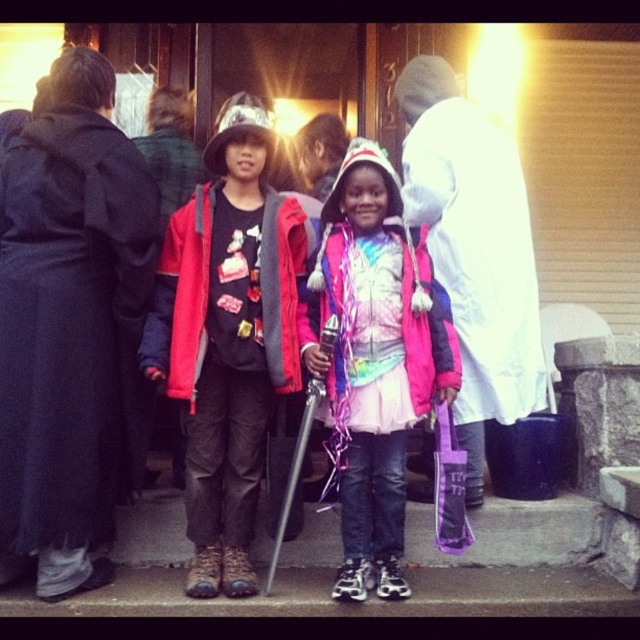
Question: Which object is closer to the camera taking this photo?

Choices:
 (A) matte red jacket at center
 (B) pink matte jacket at center
 (C) pink fabric umbrella at center
 (D) black matte robe at left

Answer: (D)

Question: Is the position of black matte robe at left more distant than that of pink fabric umbrella at center?

Choices:
 (A) no
 (B) yes

Answer: (A)

Question: Which point is farther from the camera taking this photo?

Choices:
 (A) (397, 97)
 (B) (342, 180)

Answer: (A)

Question: Which object is positioned farthest from the pink matte jacket at center?

Choices:
 (A) black matte robe at left
 (B) pink fabric umbrella at center

Answer: (A)

Question: Is the position of black matte robe at left more distant than that of pink fabric umbrella at center?

Choices:
 (A) no
 (B) yes

Answer: (A)

Question: Can you confirm if pink matte jacket at center is thinner than matte red jacket at center?

Choices:
 (A) yes
 (B) no

Answer: (B)